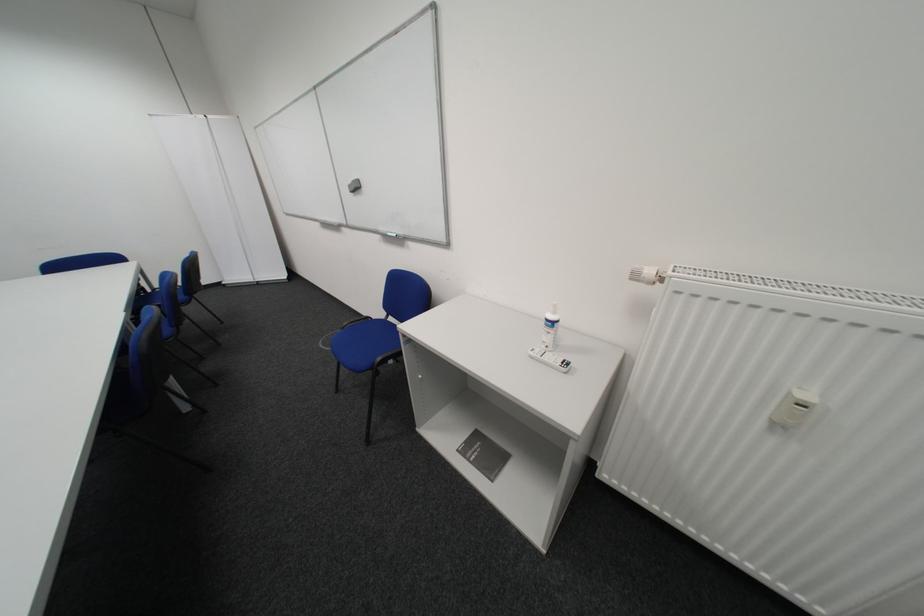
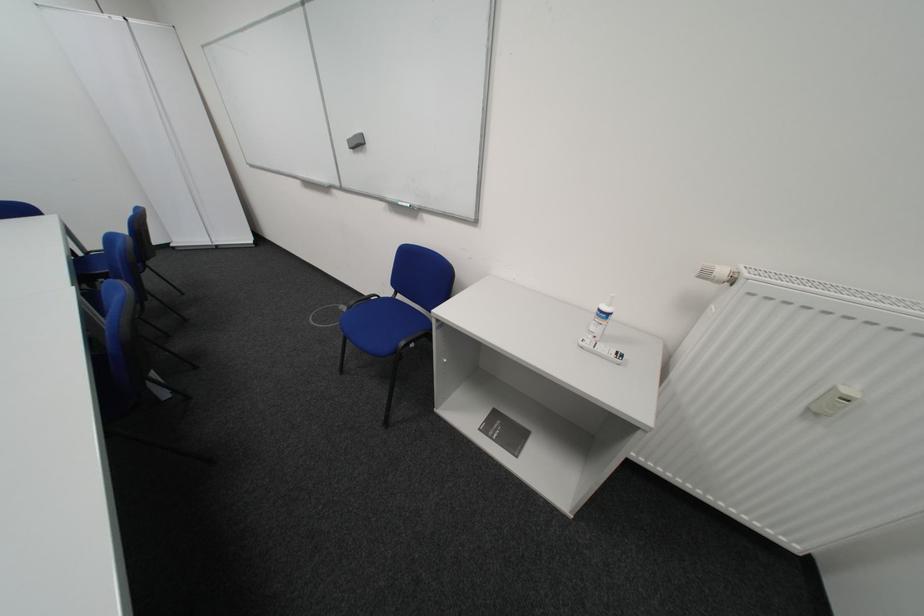
Find the pixel in the second image that matches (383,318) in the first image.

(390, 297)